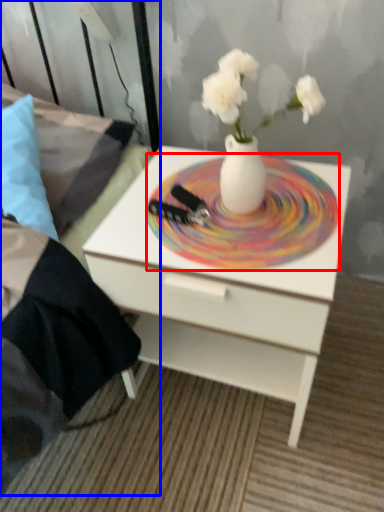
Question: Which of the following is the farthest to the observer, plate (highlighted by a red box) or bed frame (highlighted by a blue box)?

Choices:
 (A) plate
 (B) bed frame

Answer: (A)